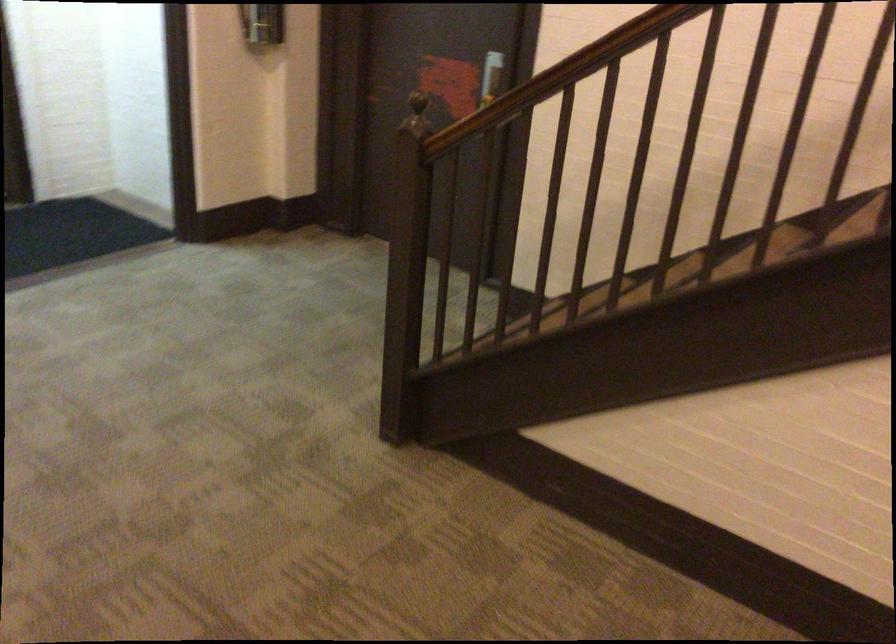
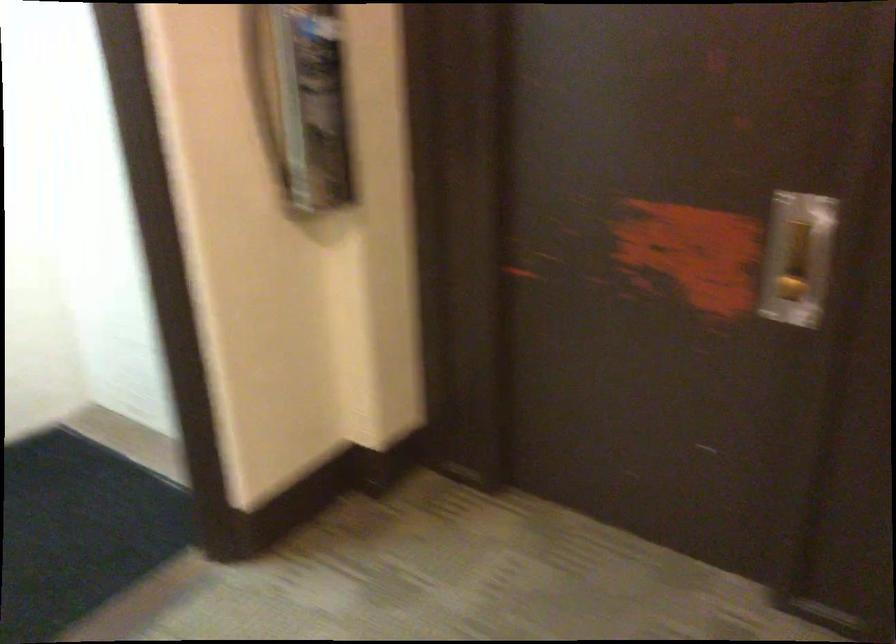
Question: Which direction would the cameraman need to move to produce the second image? Reply with the corresponding letter.

Choices:
 (A) Left
 (B) Right
 (C) Forward
 (D) Backward

Answer: (C)